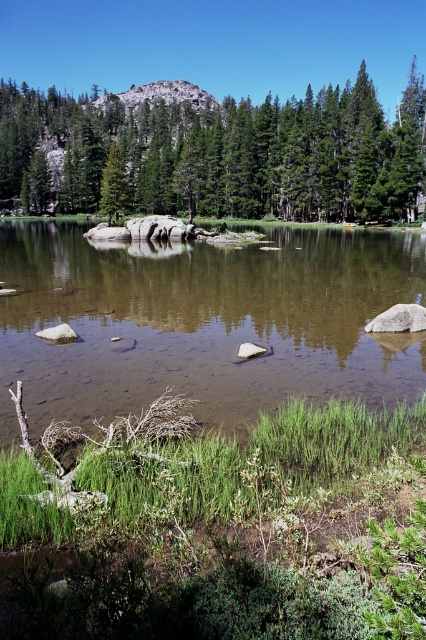
What do you see at coordinates (221, 154) in the screenshot? Image resolution: width=426 pixels, height=640 pixels. I see `green matte tree at upper center` at bounding box center [221, 154].

Is green matte tree at upper center positioned before green matte tree at center?

No.

The width and height of the screenshot is (426, 640). In order to click on green matte tree at upper center in this screenshot , I will do `click(221, 154)`.

Which of these two, brown smooth water at center or green matte tree at center, stands shorter?

green matte tree at center is shorter.

How much distance is there between brown smooth water at center and green matte tree at center?

brown smooth water at center is 26.87 meters from green matte tree at center.

I want to click on brown smooth water at center, so pos(203,323).

Who is shorter, brown smooth water at center or green matte tree at upper center?

Standing shorter between the two is brown smooth water at center.

Can you confirm if brown smooth water at center is smaller than green matte tree at upper center?

Indeed, brown smooth water at center has a smaller size compared to green matte tree at upper center.

Does point (281, 321) lie in front of point (264, 170)?

Yes.

This screenshot has height=640, width=426. In order to click on brown smooth water at center in this screenshot , I will do `click(203, 323)`.